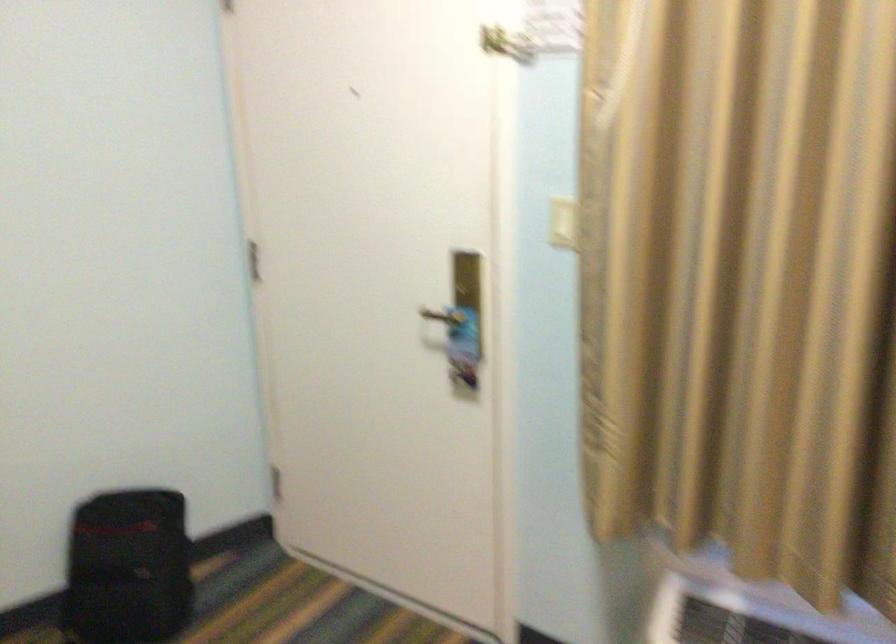
This screenshot has width=896, height=644. What do you see at coordinates (562, 223) in the screenshot?
I see `a white light switch` at bounding box center [562, 223].